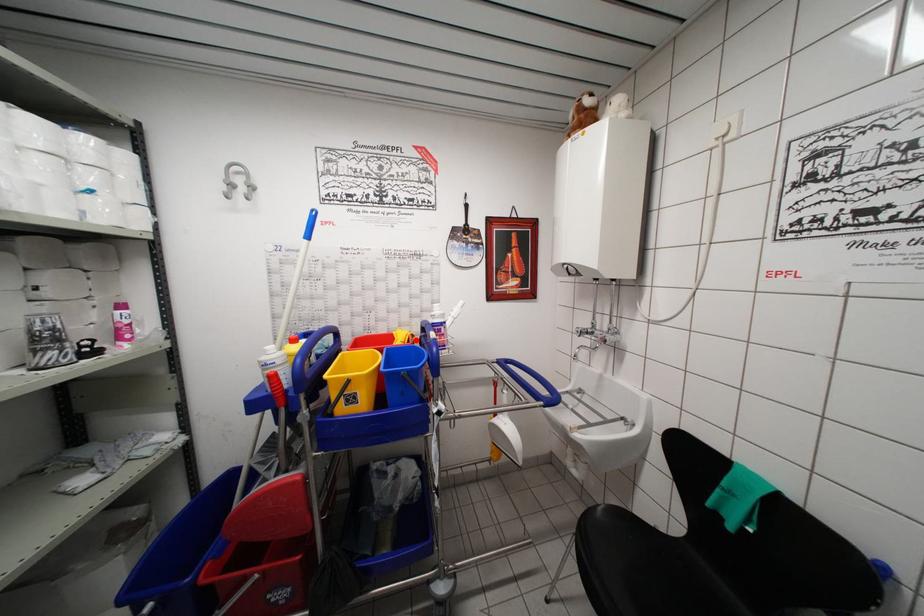
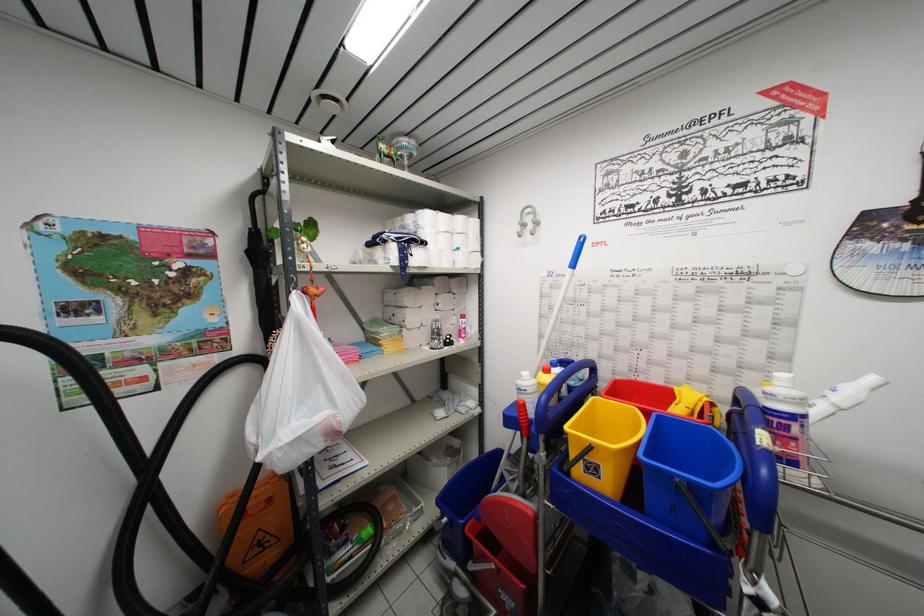
Where in the second image is the point corresponding to the highlighted location from the first image?

(715, 408)